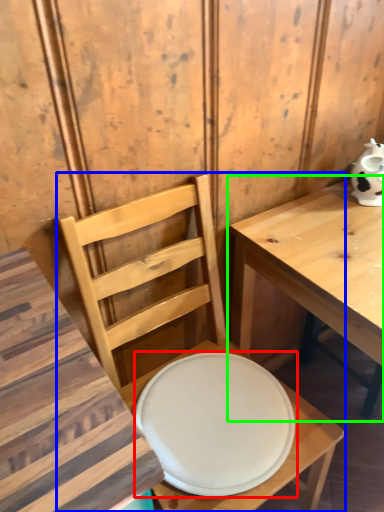
Question: Which is farther away from plate (highlighted by a red box)? chair (highlighted by a blue box) or table (highlighted by a green box)?

Choices:
 (A) chair
 (B) table

Answer: (B)